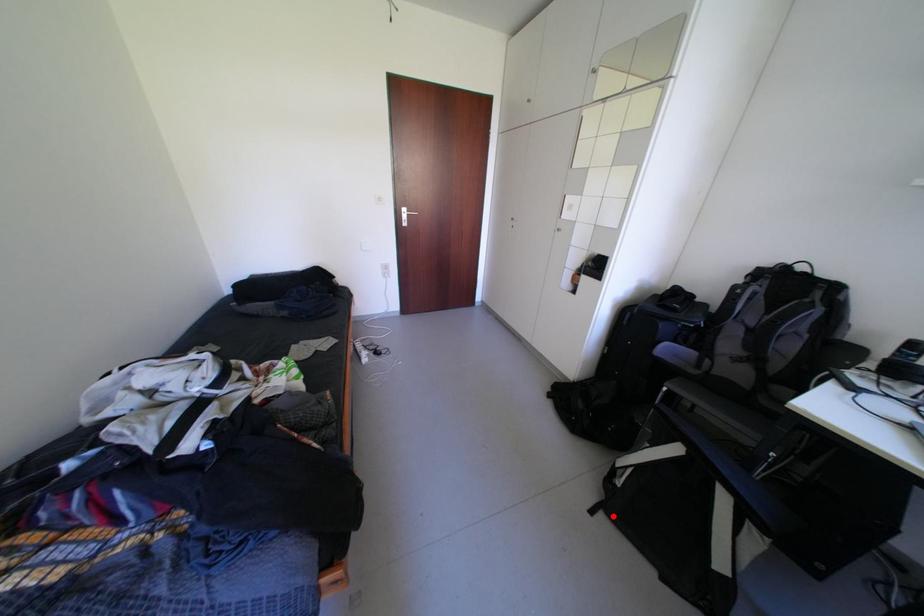
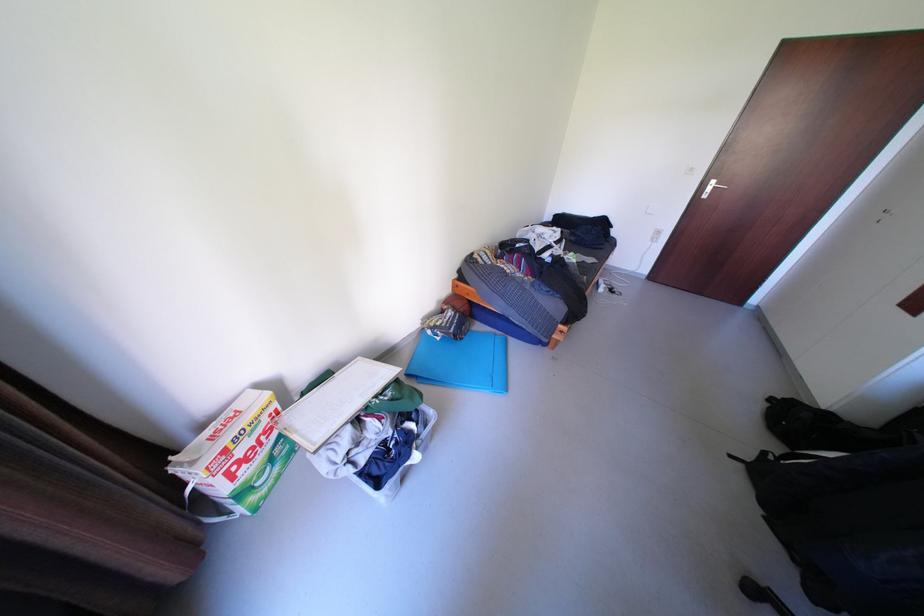
Question: I am providing you with two images of the same scene from different viewpoints. Given a red point in image1, look at the same physical point in image2. Is it:

Choices:
 (A) Closer to the viewpoint
 (B) Farther from the viewpoint

Answer: (B)